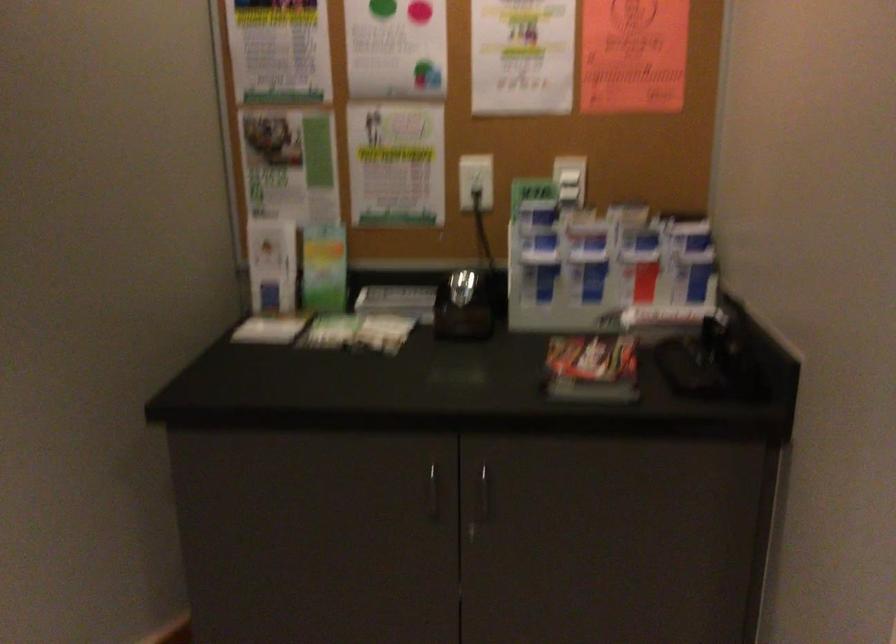
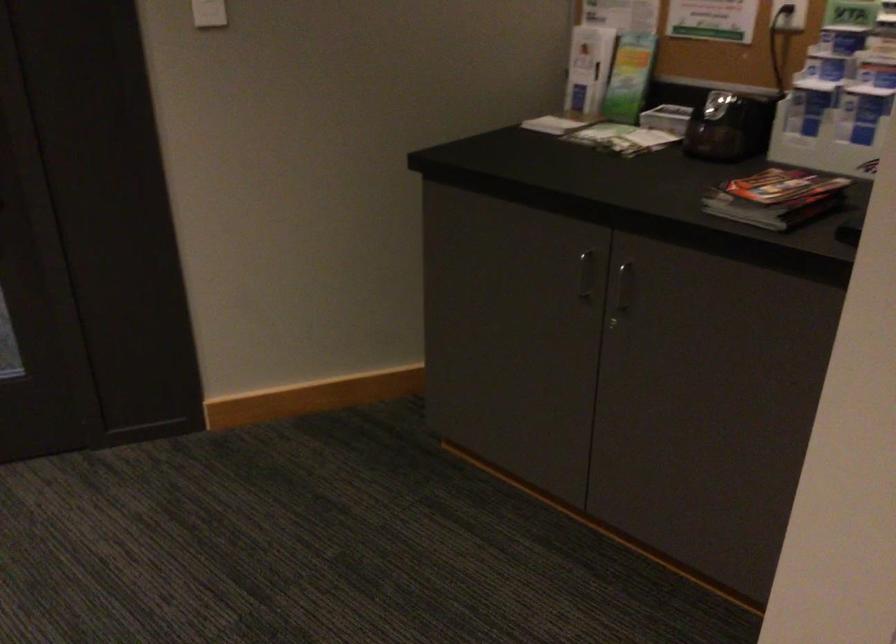
Locate, in the second image, the point that corresponds to (x=605, y=368) in the first image.

(776, 198)